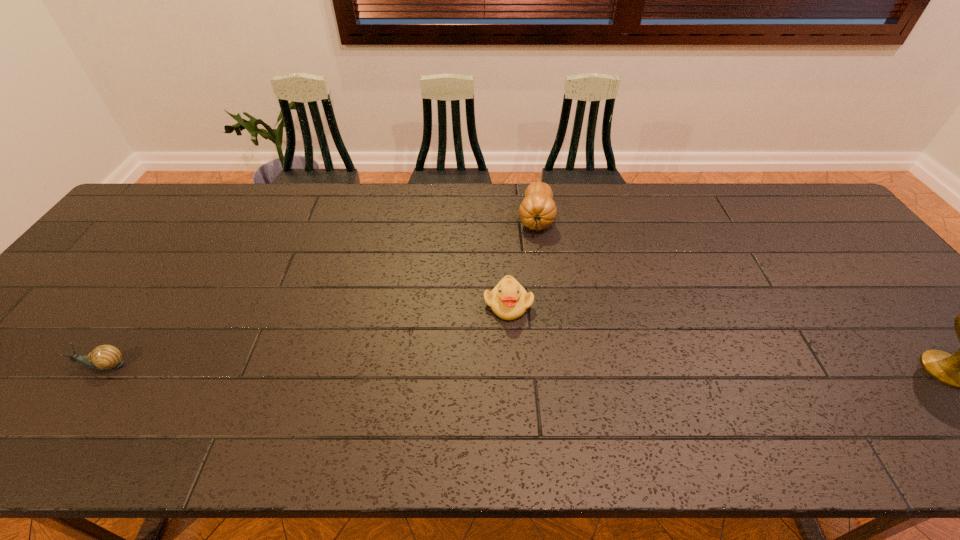
Locate an element on the screen. Image resolution: width=960 pixels, height=540 pixels. free space on the desktop that is between the shortest object and the chalice and is positioned on the stem side of the gourd is located at coordinates (525, 367).

You are a GUI agent. You are given a task and a screenshot of the screen. Output one action in this format:
    pyautogui.click(x=<x>, y=<y>)
    Task: Click on the free spot on the desktop that is between the leftmost object and the rightmost object and is positioned on the front-facing side of the third tallest object
    This screenshot has width=960, height=540.
    Given the screenshot: What is the action you would take?
    pyautogui.click(x=540, y=368)